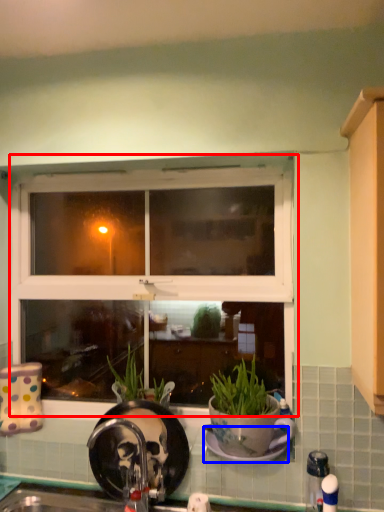
Question: Which object is further to the camera taking this photo, window (highlighted by a red box) or plate (highlighted by a blue box)?

Choices:
 (A) window
 (B) plate

Answer: (A)